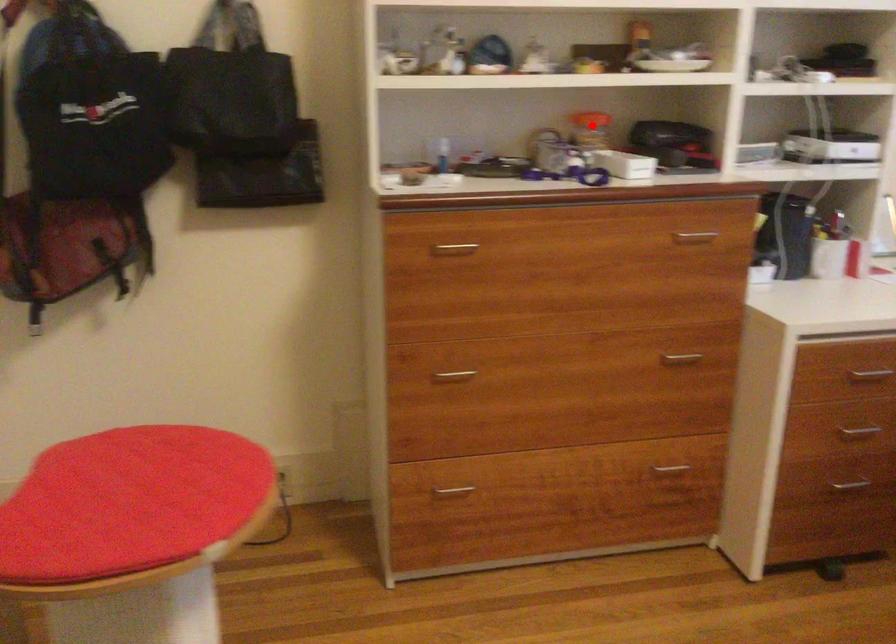
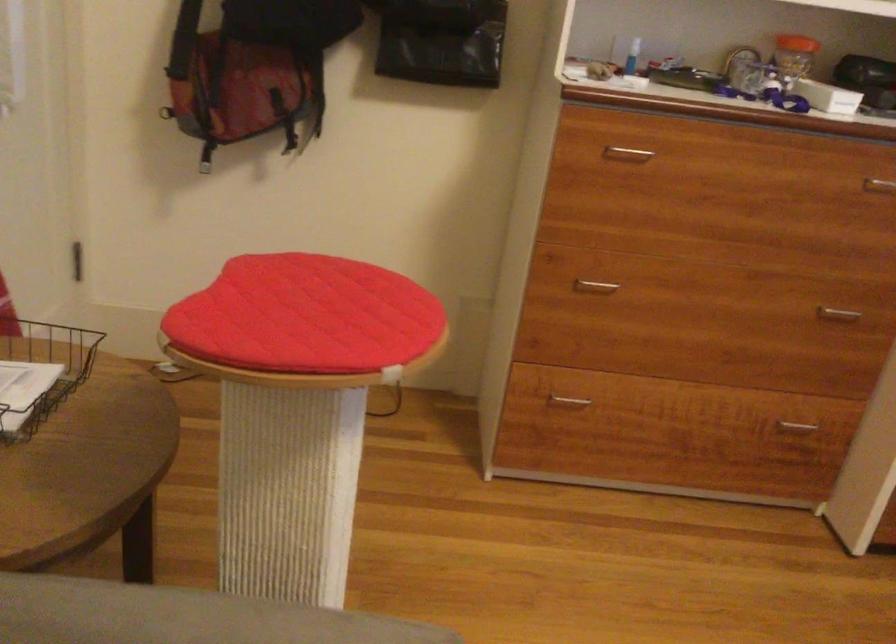
In the second image, find the point that corresponds to the highlighted location in the first image.

(794, 53)